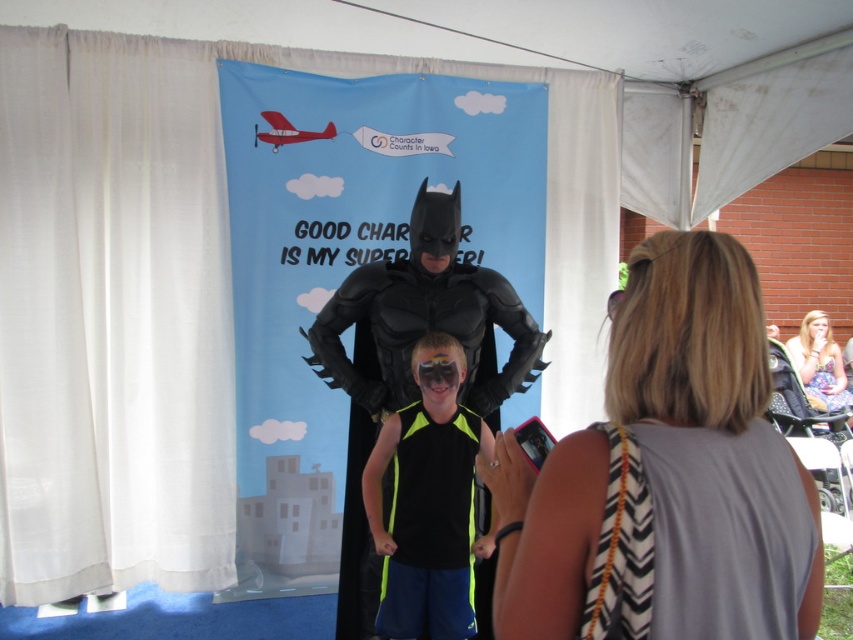
Question: Which point is farther to the camera?

Choices:
 (A) black matte tank top at center
 (B) black matte costume at center

Answer: (B)

Question: Does gray fabric tank top at center appear on the left side of black matte costume at center?

Choices:
 (A) yes
 (B) no

Answer: (B)

Question: Which object appears farthest from the camera in this image?

Choices:
 (A) floral dress at lower right
 (B) gray fabric dress at lower right

Answer: (A)

Question: Is gray fabric dress at lower right to the right of black matte tank top at center from the viewer's perspective?

Choices:
 (A) no
 (B) yes

Answer: (B)

Question: Can you confirm if gray fabric dress at lower right is smaller than black matte tank top at center?

Choices:
 (A) no
 (B) yes

Answer: (B)

Question: Which object is closer to the camera taking this photo?

Choices:
 (A) black matte costume at center
 (B) gray fabric dress at lower right
 (C) black matte tank top at center

Answer: (B)